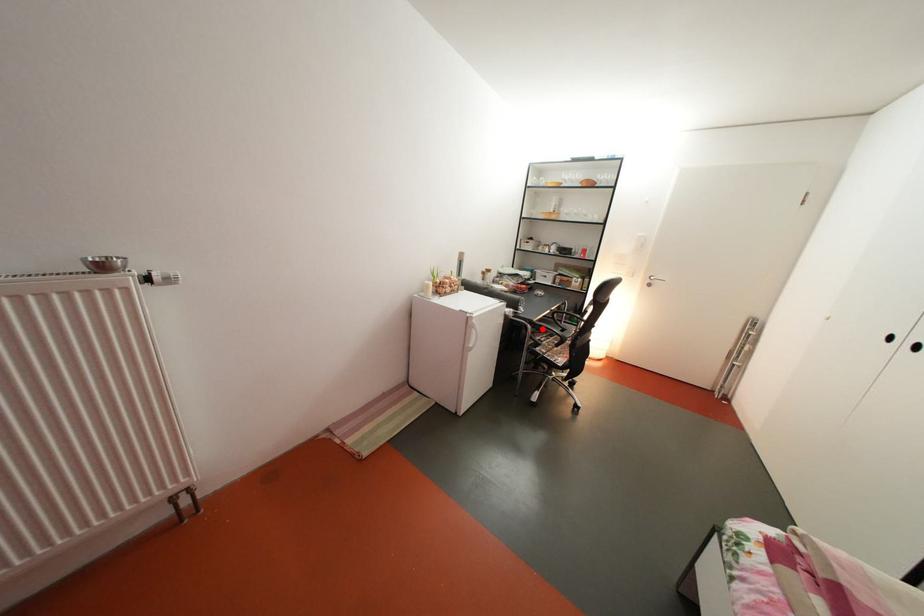
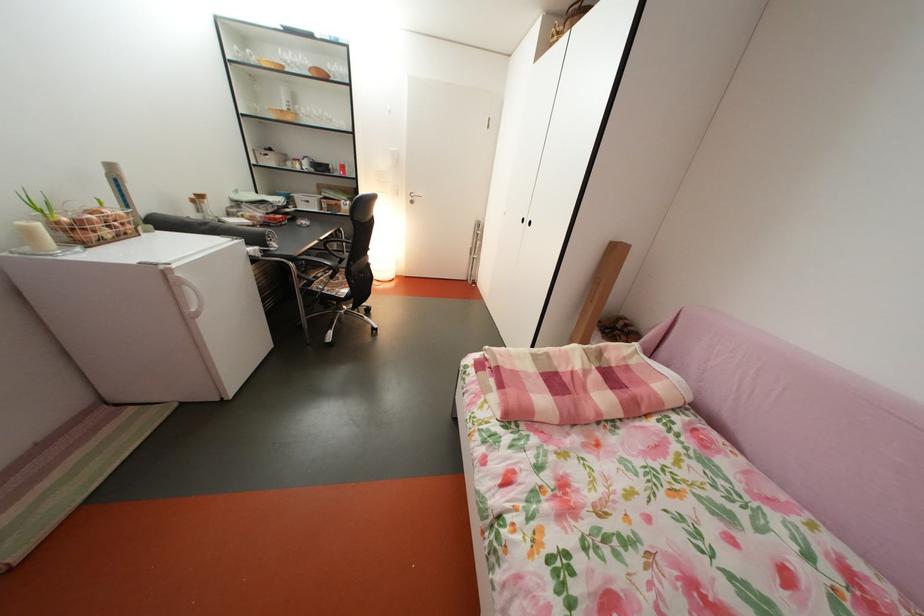
Question: I am providing you with two images of the same scene from different viewpoints. Given a red point in image1, look at the same physical point in image2. Is it:

Choices:
 (A) Closer to the viewpoint
 (B) Farther from the viewpoint

Answer: (A)